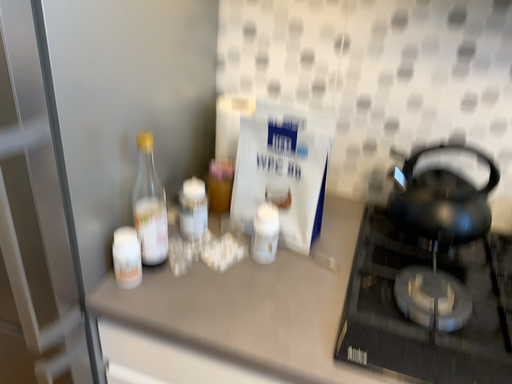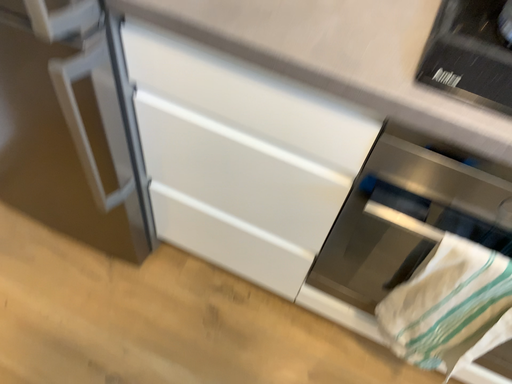
Question: How did the camera likely rotate when shooting the video?

Choices:
 (A) rotated downward
 (B) rotated upward

Answer: (A)